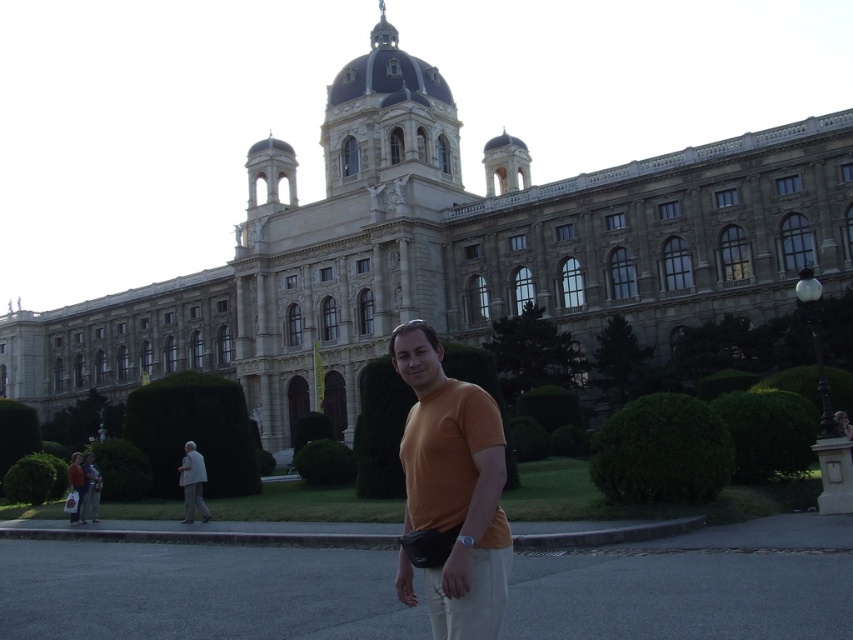
Question: Which point is farther to the camera?

Choices:
 (A) orange cotton shirt at center
 (B) light gray fabric jacket at lower left
 (C) gray stone building at center

Answer: (C)

Question: Does gray stone building at center have a larger size compared to orange cotton shirt at center?

Choices:
 (A) yes
 (B) no

Answer: (A)

Question: Can you confirm if orange cotton shirt at center is smaller than light gray fabric jacket at lower left?

Choices:
 (A) yes
 (B) no

Answer: (B)

Question: Which point is closer to the camera?

Choices:
 (A) light gray fabric jacket at lower left
 (B) gray stone building at center
 (C) orange cotton shirt at center

Answer: (C)

Question: Can you confirm if gray stone building at center is bigger than orange cotton shirt at center?

Choices:
 (A) yes
 (B) no

Answer: (A)

Question: Estimate the real-world distances between objects in this image. Which object is farther from the light gray fabric jacket at lower left?

Choices:
 (A) gray stone building at center
 (B) orange cotton shirt at center

Answer: (A)